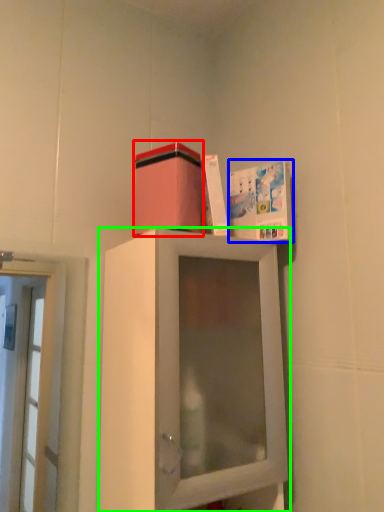
Question: Which object is the closest to the cardboard box (highlighted by a red box)? Choose among these: book cover (highlighted by a blue box) or cabinetry (highlighted by a green box).

Choices:
 (A) book cover
 (B) cabinetry

Answer: (A)